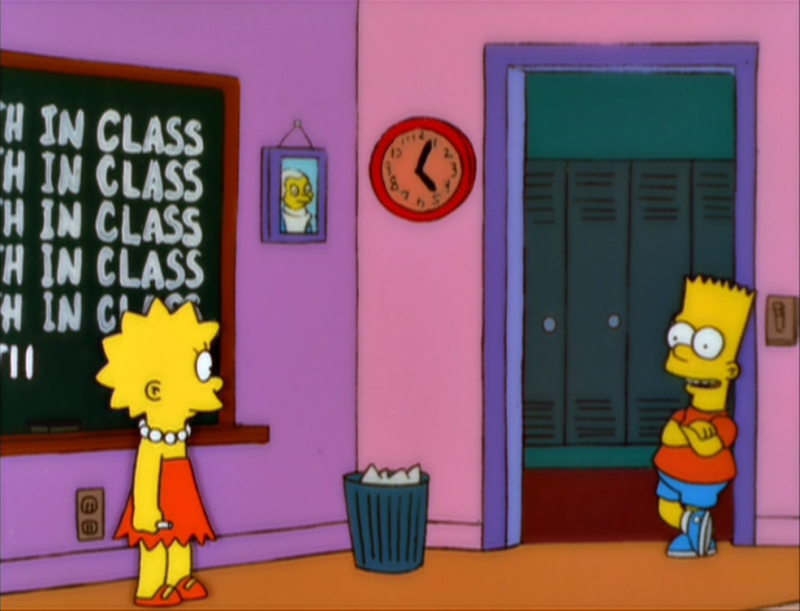
At what (x,y) coordinates should I click in order to perform the action: click on wall. Please return your answer as a coordinate pair (x, y). The height and width of the screenshot is (611, 800). Looking at the image, I should click on (418, 276).